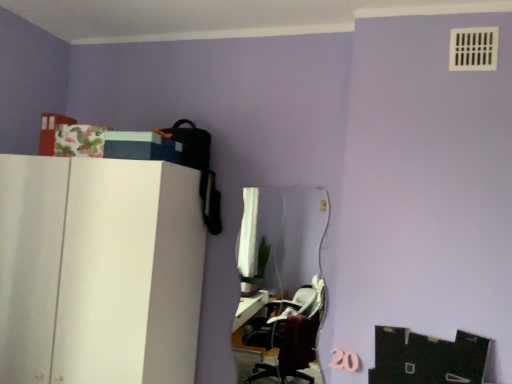
In order to face white matte cabinet at upper left, should I rotate leftwards or rightwards?

Rotate your view left by about 20.640°.

What is the approximate width of white matte cabinet at upper left?

white matte cabinet at upper left is 21.76 inches wide.

Describe the element at coordinates (99, 270) in the screenshot. I see `white matte cabinet at upper left` at that location.

In order to click on white matte cabinet at upper left in this screenshot , I will do `click(99, 270)`.

You are a GUI agent. You are given a task and a screenshot of the screen. Output one action in this format:
    pyautogui.click(x=<x>, y=<y>)
    Task: Click on the white matte cabinet at upper left
    The image size is (512, 384).
    Given the screenshot: What is the action you would take?
    click(99, 270)